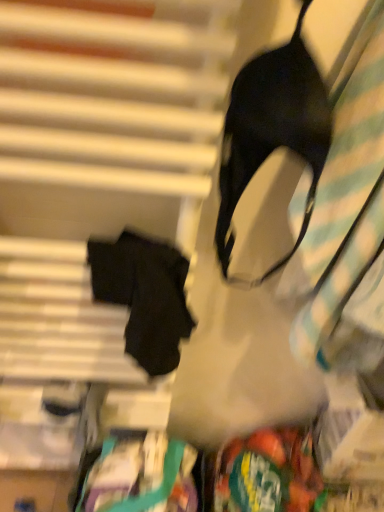
This screenshot has height=512, width=384. In order to click on black matte bra at upper right in this screenshot , I will do `click(272, 130)`.

The image size is (384, 512). I want to click on green plastic bag at lower right, so [x=268, y=473].

The image size is (384, 512). I want to click on waste on the right of black matte fabric robe at left, so click(x=268, y=473).

Is black matte fabric robe at left bigger than green plastic bag at lower right?

Incorrect, black matte fabric robe at left is not larger than green plastic bag at lower right.

Which of these two, black matte fabric robe at left or green plastic bag at lower right, stands taller?

black matte fabric robe at left.

What's the angular difference between black matte fabric robe at left and green plastic bag at lower right's facing directions?

0.000107 degrees.

Is black matte bra at upper right inside the boundaries of black matte fabric robe at left, or outside?

black matte bra at upper right is spatially situated outside black matte fabric robe at left.

You are a GUI agent. You are given a task and a screenshot of the screen. Output one action in this format:
    pyautogui.click(x=<x>, y=<y>)
    Task: Click on the robe that appears below the black matte bra at upper right (from a real-world perspective)
    This screenshot has height=512, width=384.
    Given the screenshot: What is the action you would take?
    pyautogui.click(x=144, y=295)

Measure the distance between black matte bra at upper right and black matte fabric robe at left.

7.26 inches.

From a real-world perspective, is black matte bra at upper right positioned under black matte fabric robe at left based on gravity?

Incorrect, from a real-world perspective, black matte bra at upper right is higher than black matte fabric robe at left.

Is green plastic bag at lower right aimed at black matte fabric robe at left?

No.

How distant is green plastic bag at lower right from black matte fabric robe at left?

A distance of 20.45 inches exists between green plastic bag at lower right and black matte fabric robe at left.

Is point (241, 474) farther from camera compared to point (153, 362)?

Yes, it is behind point (153, 362).

Based on the photo, from a real-world perspective, which object stands above the other?

black matte fabric robe at left is physically above.

Is green plastic bag at lower right far away from black matte bra at upper right?

No, green plastic bag at lower right is not far from black matte bra at upper right.

Is black matte bra at upper right at the back of green plastic bag at lower right?

That's not correct — green plastic bag at lower right is not looking away from black matte bra at upper right.

Is green plastic bag at lower right to the left or to the right of black matte bra at upper right in the image?

Based on their positions, green plastic bag at lower right is located to the right of black matte bra at upper right.

Is green plastic bag at lower right not within black matte bra at upper right?

green plastic bag at lower right is positioned outside black matte bra at upper right.

Is black matte fabric robe at left wider than black matte bra at upper right?

Incorrect, the width of black matte fabric robe at left does not surpass that of black matte bra at upper right.

Does point (125, 336) come behind point (225, 121)?

Yes, it is.

What are the coordinates of `brassiere above the black matte fabric robe at left (from a real-world perspective)` in the screenshot? It's located at (272, 130).

Is black matte fabric robe at left located outside black matte bra at upper right?

black matte fabric robe at left is positioned outside black matte bra at upper right.

I want to click on brassiere to the left of green plastic bag at lower right, so click(272, 130).

How different are the orientations of black matte bra at upper right and green plastic bag at lower right in degrees?

The angular difference between black matte bra at upper right and green plastic bag at lower right is 0.000144 degrees.

Considering the relative positions of black matte bra at upper right and green plastic bag at lower right in the image provided, is black matte bra at upper right to the left of green plastic bag at lower right from the viewer's perspective?

Indeed, black matte bra at upper right is positioned on the left side of green plastic bag at lower right.

In the scene shown: From the image's perspective, would you say black matte bra at upper right is positioned over green plastic bag at lower right?

Correct, black matte bra at upper right appears higher than green plastic bag at lower right in the image.

In order to click on robe that appears above the green plastic bag at lower right (from a real-world perspective) in this screenshot , I will do `click(144, 295)`.

Identify the location of robe on the left of black matte bra at upper right. (144, 295).

Based on their spatial positions, is black matte fabric robe at left or green plastic bag at lower right closer to black matte bra at upper right?

black matte fabric robe at left lies closer to black matte bra at upper right than the other object.

When comparing their distances from black matte fabric robe at left, does black matte bra at upper right or green plastic bag at lower right seem further?

green plastic bag at lower right.

From the image, which object appears to be nearer to green plastic bag at lower right, black matte bra at upper right or black matte fabric robe at left?

black matte fabric robe at left lies closer to green plastic bag at lower right than the other object.

When comparing their distances from green plastic bag at lower right, does black matte fabric robe at left or black matte bra at upper right seem further?

black matte bra at upper right.

Considering their positions, is green plastic bag at lower right positioned further to black matte bra at upper right than black matte fabric robe at left?

Among the two, green plastic bag at lower right is located further to black matte bra at upper right.

Based on their spatial positions, is green plastic bag at lower right or black matte bra at upper right closer to black matte fabric robe at left?

black matte bra at upper right is closer to black matte fabric robe at left.

Find the location of `robe between black matte bra at upper right and green plastic bag at lower right from top to bottom`. robe between black matte bra at upper right and green plastic bag at lower right from top to bottom is located at coordinates (144, 295).